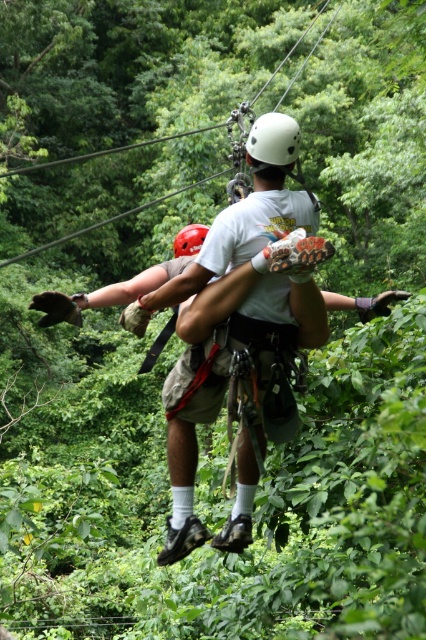
You are a safety inspector checking the equipment for two participants in a ziplining activity. You observe the matte white helmet at center and the white matte helmet at center. Which helmet has a larger size?

The matte white helmet at center is larger in size than the white matte helmet at center.

You are a safety inspector checking the zipline setup. The safety regulations state that the harness attachment point must be within a 0.1 unit radius of the center point of the helmet to ensure proper weight distribution. Given that the center of the matte white helmet at center is at coordinates point 0.544, 0.561, is the harness attachment point compliant with safety standards?

The matte white helmet at center is located at point [238,348]. Since the harness attachment point must be within a 0.1 unit radius of the helmet center, the inspector must verify the actual coordinates of the harness to determine compliance. However, based on the provided information, the helmet itself is correctly positioned at the specified coordinates.

You are a safety inspector checking the zipline setup. You notice two helmets in the image, the matte white helmet at center and the white matte helmet at center. Which one is positioned closer to the front of the scene?

The matte white helmet at center is positioned closer to the front of the scene as it is in front of the white matte helmet at center.